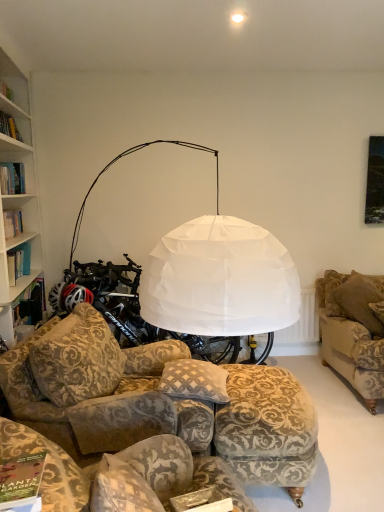
Question: Is matte green book at lower left taller than velvet floral ottoman at lower center?

Choices:
 (A) yes
 (B) no

Answer: (B)

Question: Does matte green book at lower left have a greater width compared to velvet floral ottoman at lower center?

Choices:
 (A) no
 (B) yes

Answer: (A)

Question: From a real-world perspective, does matte green book at lower left sit lower than velvet floral ottoman at lower center?

Choices:
 (A) yes
 (B) no

Answer: (B)

Question: Is matte green book at lower left oriented away from velvet floral ottoman at lower center?

Choices:
 (A) yes
 (B) no

Answer: (B)

Question: Is velvet floral ottoman at lower center located within matte green book at lower left?

Choices:
 (A) no
 (B) yes

Answer: (A)

Question: From a real-world perspective, relative to brown fabric pillow at right, positioned as the 2th pillow in left-to-right order, is patterned fabric pillow at center, which is the 1th pillow in front-to-back order, vertically above or below?

Choices:
 (A) above
 (B) below

Answer: (B)

Question: Which is correct: patterned fabric pillow at center, the 2th pillow viewed from the back, is inside brown fabric pillow at right, the 1th pillow from the right, or outside of it?

Choices:
 (A) outside
 (B) inside

Answer: (A)

Question: Relative to brown fabric pillow at right, which is the 2th pillow in front-to-back order, is patterned fabric pillow at center, the second pillow from the right, in front or behind?

Choices:
 (A) behind
 (B) front

Answer: (B)

Question: Is patterned fabric pillow at center, the second pillow from the right, taller or shorter than brown fabric pillow at right, positioned as the 2th pillow in left-to-right order?

Choices:
 (A) short
 (B) tall

Answer: (A)

Question: Relative to white fabric lampshade at upper center, is velvet floral ottoman at lower center in front or behind?

Choices:
 (A) front
 (B) behind

Answer: (A)

Question: Is velvet floral ottoman at lower center bigger or smaller than white fabric lampshade at upper center?

Choices:
 (A) big
 (B) small

Answer: (A)

Question: In terms of width, does velvet floral ottoman at lower center look wider or thinner when compared to white fabric lampshade at upper center?

Choices:
 (A) wide
 (B) thin

Answer: (A)

Question: Considering the positions of velvet floral ottoman at lower center and white fabric lampshade at upper center in the image, is velvet floral ottoman at lower center taller or shorter than white fabric lampshade at upper center?

Choices:
 (A) tall
 (B) short

Answer: (A)

Question: Is white fabric lampshade at upper center bigger or smaller than velvet floral-patterned couch at center, the 2th studio couch from the right?

Choices:
 (A) small
 (B) big

Answer: (A)

Question: Considering the positions of white fabric lampshade at upper center and velvet floral-patterned couch at center, the 1th studio couch in the left-to-right sequence, in the image, is white fabric lampshade at upper center taller or shorter than velvet floral-patterned couch at center, the 1th studio couch in the left-to-right sequence,?

Choices:
 (A) tall
 (B) short

Answer: (B)